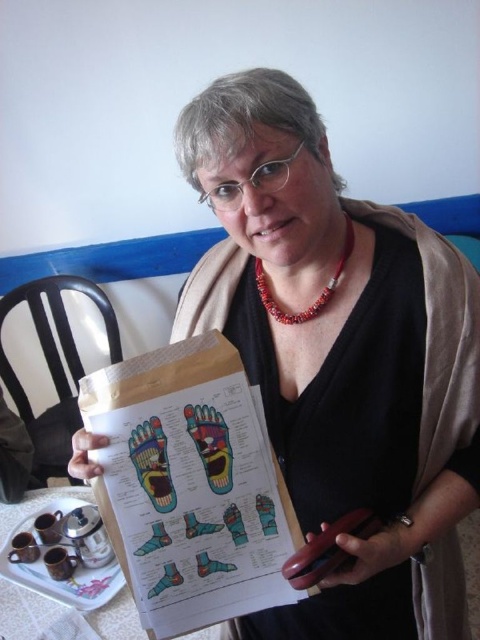
Who is more distant from viewer, (x=191, y=512) or (x=287, y=321)?

The point (x=287, y=321) is behind.

Is point (199, 579) less distant than point (319, 307)?

Yes, point (199, 579) is closer to viewer.

Find the location of `paperboard clipboard at center`. paperboard clipboard at center is located at coordinates (191, 484).

What do you see at coordinates (339, 356) in the screenshot? I see `black matte paper at center` at bounding box center [339, 356].

Who is shorter, black matte paper at center or paperboard clipboard at center?

paperboard clipboard at center

Does point (268, 189) come closer to viewer compared to point (84, 388)?

Yes.

Locate an element on the screen. The image size is (480, 640). black matte paper at center is located at coordinates (339, 356).

Is point (183, 598) positioned behind point (48, 593)?

That is False.

Between paperboard clipboard at center and white ceramic tray at lower left, which one has less height?

With less height is white ceramic tray at lower left.

The width and height of the screenshot is (480, 640). Identify the location of paperboard clipboard at center. (191, 484).

Identify the location of paperboard clipboard at center. This screenshot has height=640, width=480. (191, 484).